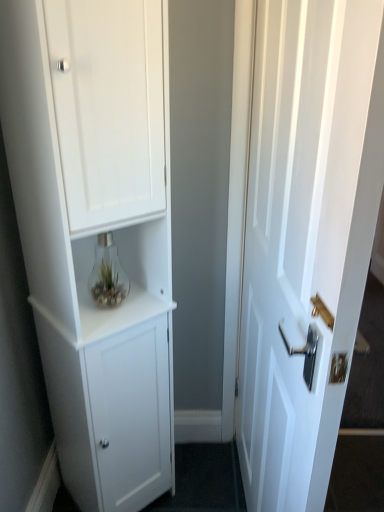
Question: Considering the relative positions of white matte cabinet at left and white glossy door at right in the image provided, is white matte cabinet at left to the left or to the right of white glossy door at right?

Choices:
 (A) left
 (B) right

Answer: (A)

Question: Considering the positions of white matte cabinet at left and white glossy door at right in the image, is white matte cabinet at left bigger or smaller than white glossy door at right?

Choices:
 (A) big
 (B) small

Answer: (A)

Question: In terms of height, does white matte cabinet at left look taller or shorter compared to white glossy door at right?

Choices:
 (A) tall
 (B) short

Answer: (A)

Question: From a real-world perspective, relative to white matte cabinet at left, is white glossy door at right vertically above or below?

Choices:
 (A) above
 (B) below

Answer: (B)

Question: Is white glossy door at right taller or shorter than white matte cabinet at left?

Choices:
 (A) tall
 (B) short

Answer: (B)

Question: Is white glossy door at right inside the boundaries of white matte cabinet at left, or outside?

Choices:
 (A) outside
 (B) inside

Answer: (A)

Question: Relative to white matte cabinet at left, is white glossy door at right in front or behind?

Choices:
 (A) front
 (B) behind

Answer: (A)